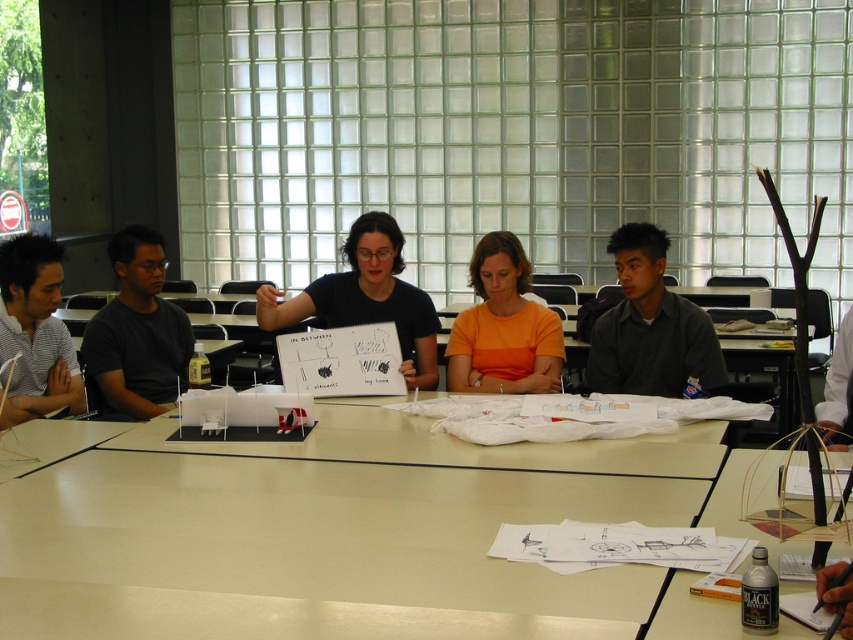
Question: Estimate the real-world distances between objects in this image. Which object is closer to the orange cotton shirt at center?

Choices:
 (A) striped shirt at left
 (B) black matte shirt at left

Answer: (B)

Question: Is dark gray shirt at center bigger than striped shirt at left?

Choices:
 (A) yes
 (B) no

Answer: (B)

Question: Is dark gray shirt at center wider than matte black bottle at lower right?

Choices:
 (A) no
 (B) yes

Answer: (A)

Question: Does matte black shirt at center come in front of striped shirt at left?

Choices:
 (A) yes
 (B) no

Answer: (B)

Question: Among these objects, which one is farthest from the camera?

Choices:
 (A) orange cotton shirt at center
 (B) black matte shirt at left
 (C) dark gray shirt at center
 (D) white glossy table at center

Answer: (A)

Question: Which object is farther from the camera taking this photo?

Choices:
 (A) black matte shirt at left
 (B) dark gray shirt at center

Answer: (A)